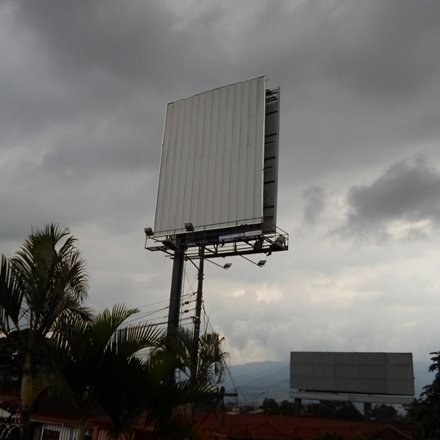
At what (x,y) coordinates should I click in order to perform the action: click on lights. Please return your answer as a coordinate pair (x, y). The width and height of the screenshot is (440, 440). Looking at the image, I should click on (228, 265).